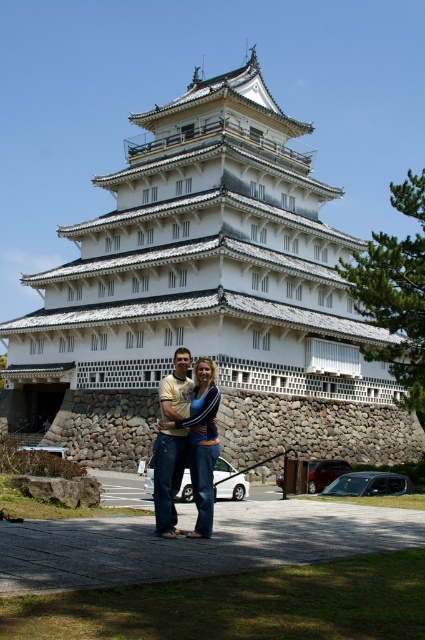
Is white wooden palace at center wider than denim jeans at center?

Correct, the width of white wooden palace at center exceeds that of denim jeans at center.

Who is lower down, white wooden palace at center or denim jeans at center?

denim jeans at center is lower down.

Is point (164, 125) closer to viewer compared to point (201, 412)?

No, it is behind (201, 412).

At what (x,y) coordinates should I click in order to perform the action: click on white wooden palace at center. Please return your answer as a coordinate pair (x, y). The width and height of the screenshot is (425, 640). Looking at the image, I should click on tap(206, 296).